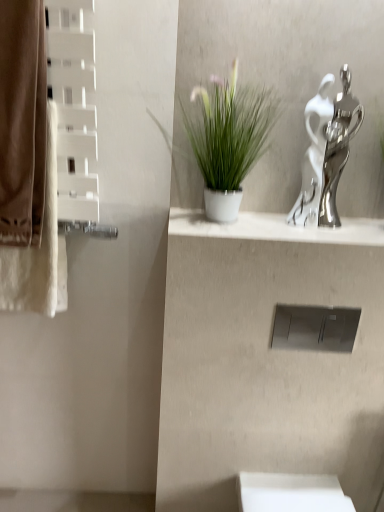
Question: Are white glossy vase at upper center and green matte plant at center far apart?

Choices:
 (A) no
 (B) yes

Answer: (A)

Question: Would you say white glossy vase at upper center is outside green matte plant at center?

Choices:
 (A) no
 (B) yes

Answer: (B)

Question: Is white glossy vase at upper center turned away from green matte plant at center?

Choices:
 (A) yes
 (B) no

Answer: (B)

Question: Is white glossy vase at upper center in front of green matte plant at center?

Choices:
 (A) no
 (B) yes

Answer: (A)

Question: Is white glossy vase at upper center to the left of green matte plant at center from the viewer's perspective?

Choices:
 (A) no
 (B) yes

Answer: (A)

Question: Is green matte plant at center located within white glossy vase at upper center?

Choices:
 (A) yes
 (B) no

Answer: (B)

Question: Can you confirm if white glossy vase at upper center is taller than brown cotton bath towel at left?

Choices:
 (A) no
 (B) yes

Answer: (A)

Question: From a real-world perspective, is white glossy vase at upper center over brown cotton bath towel at left?

Choices:
 (A) no
 (B) yes

Answer: (A)

Question: Considering the relative sizes of white glossy vase at upper center and brown cotton bath towel at left in the image provided, is white glossy vase at upper center thinner than brown cotton bath towel at left?

Choices:
 (A) yes
 (B) no

Answer: (B)

Question: Could you tell me if white glossy vase at upper center is facing brown cotton bath towel at left?

Choices:
 (A) yes
 (B) no

Answer: (B)

Question: From a real-world perspective, is white glossy vase at upper center under brown cotton bath towel at left?

Choices:
 (A) no
 (B) yes

Answer: (B)

Question: Can you confirm if white glossy vase at upper center is shorter than brown cotton bath towel at left?

Choices:
 (A) yes
 (B) no

Answer: (A)

Question: Is brown cotton bath towel at left taller than brown fabric curtain at left?

Choices:
 (A) no
 (B) yes

Answer: (B)